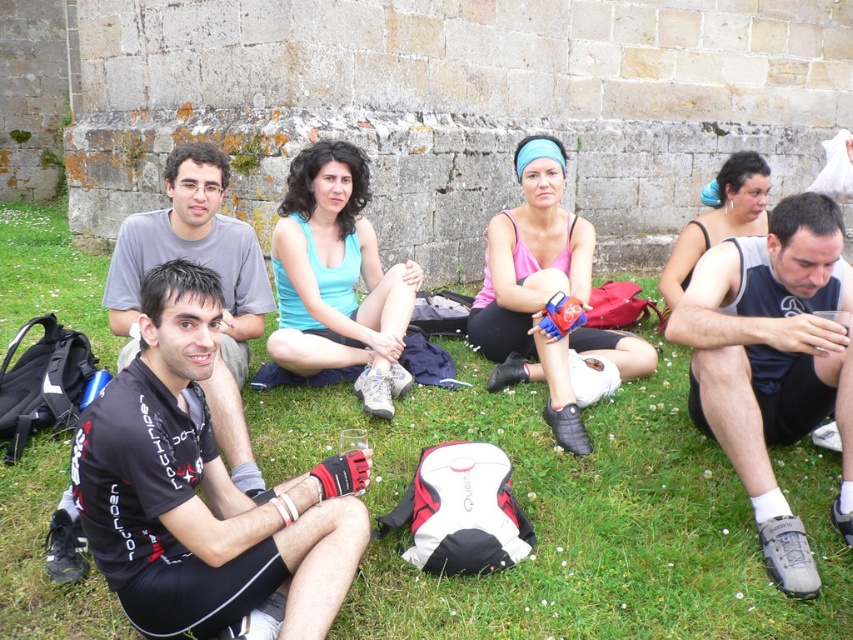
You are organizing a group photo and need to arrange the black jersey at center and the gray matte shirt at left side by side. Based on their sizes, which one requires more horizontal space?

The black jersey at center requires more horizontal space because its width surpasses that of the gray matte shirt at left.

You are a photographer trying to capture a group photo of the light blue tank top at center and the black matte shirt at center. Since you want to ensure both subjects are in focus, you need to know which one is closer to the camera. Can you determine which is nearer based on their sizes?

The light blue tank top at center is thinner than the black matte shirt at center, so it is closer to the camera.

You are organizing a group photo and need to arrange the black jersey at center and the gray matte shirt at left so that both are visible. Considering their sizes, which one should be placed closer to the camera to ensure both are clearly visible?

The black jersey at center is smaller than the gray matte shirt at left, so to ensure both are clearly visible in the group photo, the black jersey at center should be placed closer to the camera.